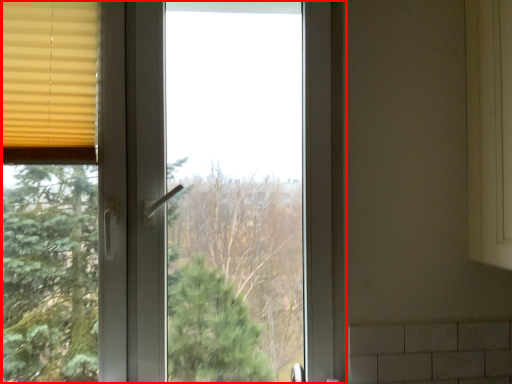
Question: From the image's perspective, what is the correct spatial relationship of window (annotated by the red box) in relation to window blind?

Choices:
 (A) below
 (B) above

Answer: (A)